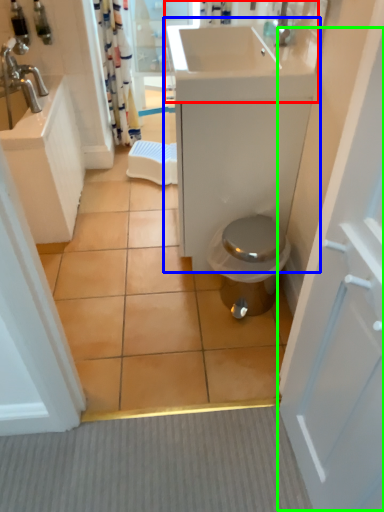
Question: Based on their relative distances, which object is nearer to sink (highlighted by a red box)? Choose from bathroom cabinet (highlighted by a blue box) and screen door (highlighted by a green box).

Choices:
 (A) bathroom cabinet
 (B) screen door

Answer: (A)